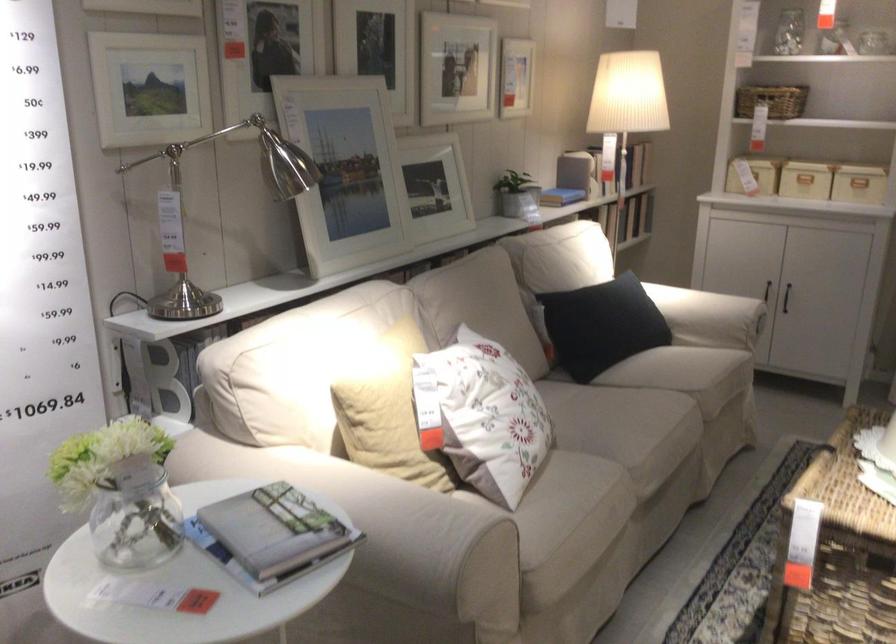
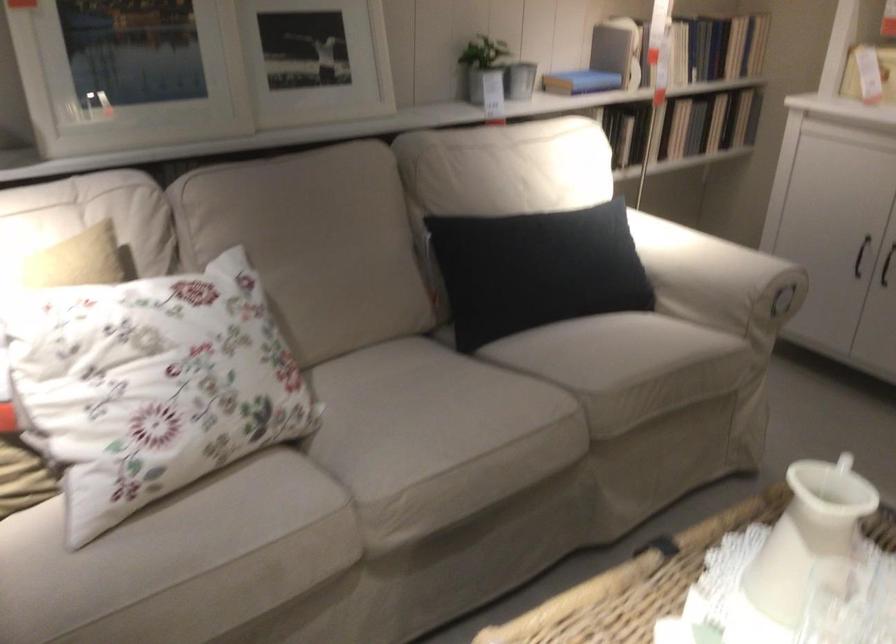
The point at (x=616, y=317) is marked in the first image. Where is the corresponding point in the second image?

(536, 270)